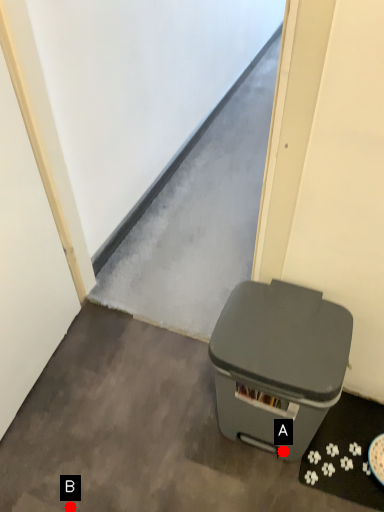
Question: Two points are circled on the image, labeled by A and B beside each circle. Which point is closer to the camera?

Choices:
 (A) A is closer
 (B) B is closer

Answer: (B)